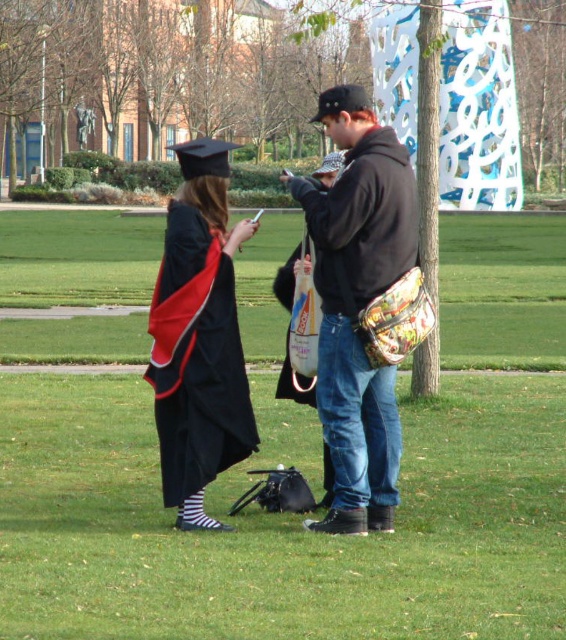
You are a photographer trying to capture a group photo of the black fleece jacket at center and the matte black graduation gown at center. Which person should stand behind the other to ensure both are fully visible in the photo?

The black fleece jacket at center is much taller than the matte black graduation gown at center, so the matte black graduation gown at center should stand behind the black fleece jacket at center to ensure both are fully visible in the photo.

Consider the image. What is located at the coordinates point (362, 307)?

The black fleece jacket at center is located at point (362, 307).